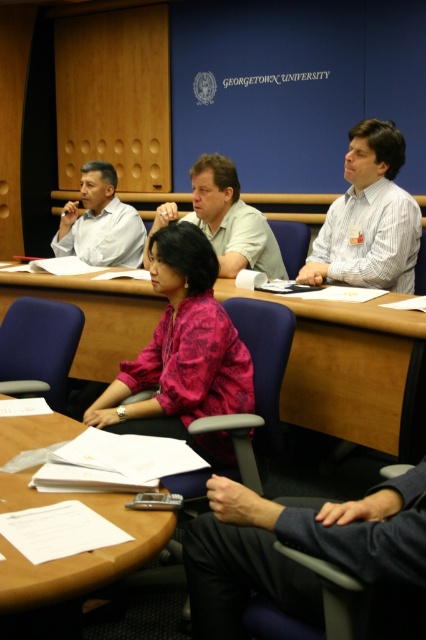
Does dark blue fabric pants at lower right have a greater width compared to light brown shirt at center?

Incorrect, dark blue fabric pants at lower right's width does not surpass light brown shirt at center's.

Does dark blue fabric pants at lower right have a smaller size compared to light brown shirt at center?

Correct, dark blue fabric pants at lower right occupies less space than light brown shirt at center.

Is point (244, 592) closer to camera compared to point (244, 212)?

Yes, it is.

You are a GUI agent. You are given a task and a screenshot of the screen. Output one action in this format:
    pyautogui.click(x=<x>, y=<y>)
    Task: Click on the dark blue fabric pants at lower right
    The image size is (426, 640).
    Given the screenshot: What is the action you would take?
    pyautogui.click(x=307, y=554)

Between point (409, 609) and point (66, 225), which one is positioned behind?

The point (66, 225) is behind.

Is point (210, 632) more distant than point (83, 221)?

No, it is in front of (83, 221).

Is point (207, 561) behind point (66, 237)?

No.

This screenshot has height=640, width=426. Find the location of `dark blue fabric pants at lower right`. dark blue fabric pants at lower right is located at coordinates (307, 554).

Who is more distant from viewer, (103,324) or (328,237)?

Point (328,237)

Image resolution: width=426 pixels, height=640 pixels. I want to click on wooden table at center, so click(354, 371).